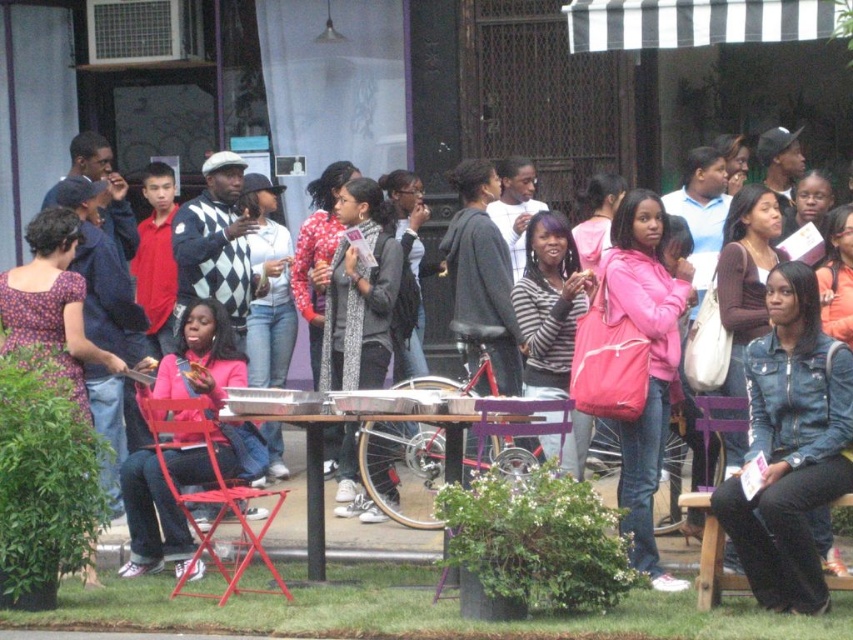
You are standing in the crowd at the event and want to sit down. You see the metallic red chair at lower left and the purple wood chair at center. Which chair is closer to you?

The metallic red chair at lower left is closer to you than the purple wood chair at center.

You are a photographer standing at the edge of the crowd. You want to take a photo of the wooden table at center without the pink fabric backpack at center blocking it. How can you adjust your position to achieve this?

The pink fabric backpack at center is in front of the wooden table at center. To avoid the backpack blocking the table, move to a position where you can see behind the backpack, such as moving to the side or slightly behind the backpack to capture the table without obstruction.

You are organizing a small event and need to seat two guests. You have a metallic red chair at lower left and a purple wood chair at center available. Which chair is wider?

Result: The metallic red chair at lower left is wider than the purple wood chair at center.